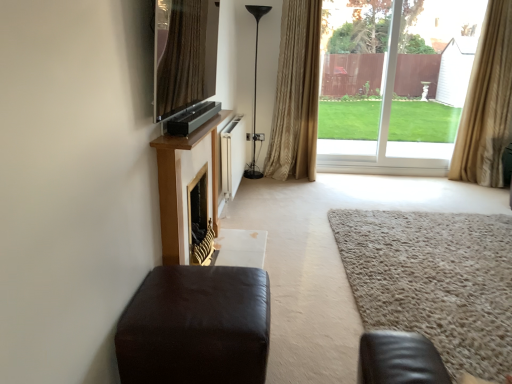
Question: Is beige shaggy carpet at lower right in front of or behind gold textured curtain at center, which is the 1th curtain from left to right, in the image?

Choices:
 (A) behind
 (B) front

Answer: (B)

Question: Would you say beige shaggy carpet at lower right is to the left or to the right of gold textured curtain at center, arranged as the 2th curtain when viewed from the right, in the picture?

Choices:
 (A) right
 (B) left

Answer: (A)

Question: Which of these objects is positioned closest to the matte black ottoman at lower left?

Choices:
 (A) beige fabric curtain at right, the 1th curtain positioned from the right
 (B) beige shaggy carpet at lower right
 (C) matte black tv at upper center
 (D) transparent glass door at upper right
 (E) gold textured curtain at center, arranged as the 2th curtain when viewed from the right

Answer: (B)

Question: Estimate the real-world distances between objects in this image. Which object is farther from the transparent glass door at upper right?

Choices:
 (A) matte black ottoman at lower left
 (B) gold textured curtain at center, which is the 1th curtain from left to right
 (C) beige shaggy carpet at lower right
 (D) matte black tv at upper center
 (E) black matte floor lamp at center

Answer: (A)